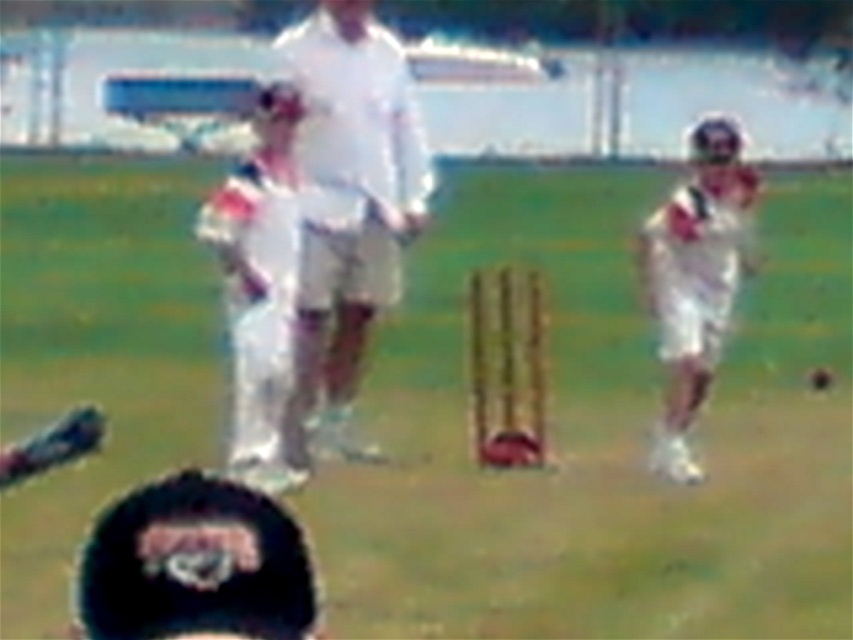
You are a photographer standing at the camera position. You want to capture a closeup shot of the white cloth cricket bat at center. Given that the bat is 9.87 meters away, can you estimate if you need to use a telephoto lens to achieve this?

The white cloth cricket bat at center is 9.87 meters away from the camera. To capture a closeup shot from this distance, a telephoto lens would be necessary to magnify the subject and reduce the surrounding area in the frame.

You are a spectator at the cricket match and want to take a photo of the black fabric cap at lower left and the white cloth cricket bat at center. Which object will appear larger in your photo?

The white cloth cricket bat at center will appear larger in the photo because it is closer to the viewer than the black fabric cap at lower left.

You are a drone operator trying to capture a close shot of the cricket match. You have two points marked on your screen, point (x=401, y=154) and point (x=674, y=468). Which point should you move the drone closer to if you want to get a clearer image of the wickets?

Point (x=401, y=154) is closer to the viewer than point (x=674, y=468), so moving the drone closer to point (x=401, y=154) would provide a clearer image of the wickets.